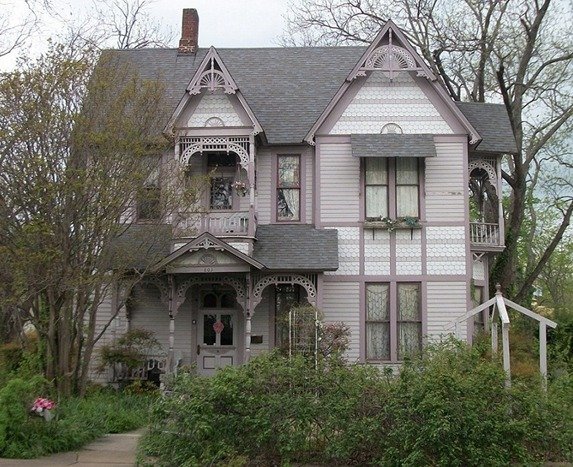
At what (x,y) coordinates should I click in order to perform the action: click on decoration on door. Please return your answer as a coordinate pair (x, y). Looking at the image, I should click on (215, 328).